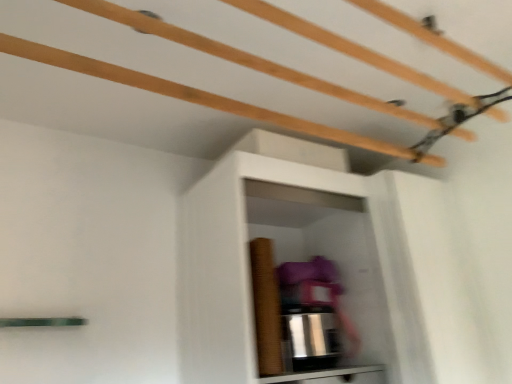
Question: Is white matte shelf at center taller than matte brown cabinet at lower center?

Choices:
 (A) yes
 (B) no

Answer: (B)

Question: From the image's perspective, is white matte shelf at center located beneath matte brown cabinet at lower center?

Choices:
 (A) yes
 (B) no

Answer: (B)

Question: Would you consider white matte shelf at center to be distant from matte brown cabinet at lower center?

Choices:
 (A) no
 (B) yes

Answer: (A)

Question: Does white matte shelf at center come in front of matte brown cabinet at lower center?

Choices:
 (A) yes
 (B) no

Answer: (A)

Question: Does white matte shelf at center come behind matte brown cabinet at lower center?

Choices:
 (A) no
 (B) yes

Answer: (A)

Question: Is white matte shelf at center next to matte brown cabinet at lower center and touching it?

Choices:
 (A) no
 (B) yes

Answer: (A)

Question: Is matte brown cabinet at lower center at the left side of white matte shelf at center?

Choices:
 (A) no
 (B) yes

Answer: (A)

Question: Can you confirm if matte brown cabinet at lower center is smaller than white matte shelf at center?

Choices:
 (A) yes
 (B) no

Answer: (A)

Question: Is white matte shelf at center completely or partially inside matte brown cabinet at lower center?

Choices:
 (A) no
 (B) yes

Answer: (A)

Question: Considering the relative sizes of matte brown cabinet at lower center and white matte shelf at center in the image provided, is matte brown cabinet at lower center thinner than white matte shelf at center?

Choices:
 (A) yes
 (B) no

Answer: (A)

Question: From the image's perspective, does matte brown cabinet at lower center appear lower than white matte shelf at center?

Choices:
 (A) no
 (B) yes

Answer: (B)

Question: Is matte brown cabinet at lower center bigger than white matte shelf at center?

Choices:
 (A) yes
 (B) no

Answer: (B)

Question: Looking at their shapes, would you say matte brown cabinet at lower center is wider or thinner than white matte shelf at center?

Choices:
 (A) thin
 (B) wide

Answer: (A)